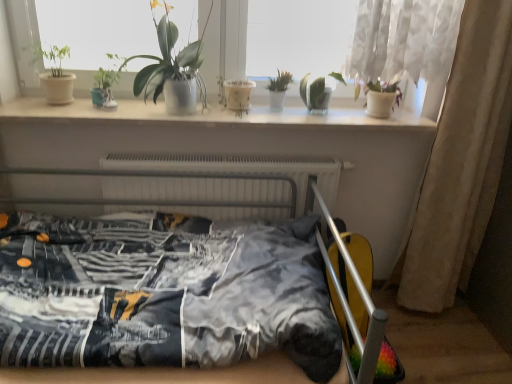
Measure the distance between point (380, 81) and camera.

Point (380, 81) and camera are 1.74 meters apart from each other.

Consider the image. What is the approximate width of green matte plant at center, the second houseplant when ordered from right to left?

It is 3.51 inches.

In order to face green matte plant pot at upper left, the 5th houseplant when ordered from right to left, should I rotate leftwards or rightwards?

Rotate your view left by about 24.827°.

Locate an element on the screen. matte white flowerpot at center is located at coordinates tap(238, 94).

Does point (68, 97) come closer to viewer compared to point (280, 84)?

Yes, it is in front of point (280, 84).

Which of these two, green matte plant pot at upper left, the 5th houseplant when ordered from right to left, or green matte plant at center, the second houseplant when ordered from right to left, stands shorter?

green matte plant at center, the second houseplant when ordered from right to left, is shorter.

From the image's perspective, relative to green matte plant at center, the second houseplant when ordered from right to left, is green matte plant pot at upper left, the 5th houseplant when ordered from right to left, above or below?

green matte plant pot at upper left, the 5th houseplant when ordered from right to left, is situated higher than green matte plant at center, the second houseplant when ordered from right to left, in the image.

Is translucent glass vase at upper center, which appears as the 1th houseplant when viewed from the right, at the right side of matte white flowerpot at center?

Yes.

Could matte white flowerpot at center be considered to be inside translucent glass vase at upper center, positioned as the 5th houseplant in left-to-right order?

No.

From a real-world perspective, who is located higher, translucent glass vase at upper center, positioned as the 5th houseplant in left-to-right order, or matte white flowerpot at center?

From a 3D spatial view, translucent glass vase at upper center, positioned as the 5th houseplant in left-to-right order, is above.

I want to click on flowerpot in front of the translucent glass vase at upper center, positioned as the 5th houseplant in left-to-right order, so click(238, 94).

Who is more distant, green matte pot at upper left, the 4th houseplant viewed from the right, or green matte plant at center, the second houseplant when ordered from right to left?

green matte plant at center, the second houseplant when ordered from right to left.

I want to click on houseplant that is the 1st one when counting upward from the green matte pot at upper left, the 4th houseplant viewed from the right (from the image's perspective), so [278, 89].

Is green matte pot at upper left, which is the second houseplant from left to right, surrounding green matte plant at center, the 4th houseplant from the left?

No, green matte plant at center, the 4th houseplant from the left, is not a part of green matte pot at upper left, which is the second houseplant from left to right.

Is point (100, 91) positioned before point (283, 83)?

Yes, it is in front of point (283, 83).

Is white sheer curtain at right completely or partially outside of green matte pot at upper left, which is the second houseplant from left to right?

Absolutely, white sheer curtain at right is external to green matte pot at upper left, which is the second houseplant from left to right.

From the picture: Considering the relative positions of white sheer curtain at right and green matte pot at upper left, the 4th houseplant viewed from the right, in the image provided, is white sheer curtain at right to the left of green matte pot at upper left, the 4th houseplant viewed from the right, from the viewer's perspective?

Incorrect, white sheer curtain at right is not on the left side of green matte pot at upper left, the 4th houseplant viewed from the right.

From the picture: From the image's perspective, would you say white sheer curtain at right is shown under green matte pot at upper left, which is the second houseplant from left to right?

Correct, white sheer curtain at right appears lower than green matte pot at upper left, which is the second houseplant from left to right, in the image.

There is a white sheer curtain at right. At what (x,y) coordinates should I click in order to perform the action: click on the 2nd houseplant above it (from the image's perspective). Please return your answer as a coordinate pair (x, y). The image size is (512, 384). Looking at the image, I should click on (104, 87).

What's the angular difference between green matte pot at upper left, the 4th houseplant viewed from the right, and pink matte orchid at upper right's facing directions?

The angle between the facing direction of green matte pot at upper left, the 4th houseplant viewed from the right, and the facing direction of pink matte orchid at upper right is 0.000103 degrees.

From the image's perspective, who appears lower, green matte pot at upper left, which is the second houseplant from left to right, or pink matte orchid at upper right?

pink matte orchid at upper right, from the image's perspective.

Looking at this image, which of these two, green matte pot at upper left, which is the second houseplant from left to right, or pink matte orchid at upper right, is smaller?

With smaller size is green matte pot at upper left, which is the second houseplant from left to right.

Does green matte pot at upper left, the 4th houseplant viewed from the right, turn towards pink matte orchid at upper right?

No, green matte pot at upper left, the 4th houseplant viewed from the right, does not turn towards pink matte orchid at upper right.

Which object is more forward, green matte pot at upper left, which is the second houseplant from left to right, or white glossy window sill at upper center?

Positioned in front is white glossy window sill at upper center.

Considering the positions of point (116, 80) and point (93, 115), is point (116, 80) closer or farther from the camera than point (93, 115)?

Point (116, 80) is positioned farther from the camera compared to point (93, 115).

From a real-world perspective, is green matte pot at upper left, the 4th houseplant viewed from the right, located beneath white glossy window sill at upper center?

No, from a real-world perspective, green matte pot at upper left, the 4th houseplant viewed from the right, is not under white glossy window sill at upper center.

Is pink matte orchid at upper right next to green leafy plant at upper center and touching it?

No, pink matte orchid at upper right is not with green leafy plant at upper center.

From a real-world perspective, which object stands above the other?

green leafy plant at upper center is physically above.

Is pink matte orchid at upper right facing towards green leafy plant at upper center?

No, pink matte orchid at upper right is not facing towards green leafy plant at upper center.

Considering the sizes of objects pink matte orchid at upper right and green leafy plant at upper center in the image provided, who is shorter, pink matte orchid at upper right or green leafy plant at upper center?

With less height is pink matte orchid at upper right.

The height and width of the screenshot is (384, 512). What are the coordinates of `the 1st houseplant above when counting from the green matte plant at center, the 4th houseplant from the left (from the image's perspective)` in the screenshot? It's located at (54, 74).

Identify the location of flowerpot that is below the translucent glass vase at upper center, which appears as the 1th houseplant when viewed from the right (from the image's perspective). (238, 94).

Which object lies further to the anchor point green matte plant at center, the 4th houseplant from the left, white metallic radiator at center or white glossy window sill at upper center?

The object further to green matte plant at center, the 4th houseplant from the left, is white metallic radiator at center.

Which object lies nearer to the anchor point green matte plant pot at upper left, arranged as the first houseplant when viewed from the left, white glossy window sill at upper center or matte white flowerpot at center?

white glossy window sill at upper center is closer to green matte plant pot at upper left, arranged as the first houseplant when viewed from the left.

Looking at the image, which one is located closer to white glossy window sill at upper center, green matte plant pot at upper left, arranged as the first houseplant when viewed from the left, or green glossy plant at upper center, the 3th houseplant from the left?

Based on the image, green glossy plant at upper center, the 3th houseplant from the left, appears to be nearer to white glossy window sill at upper center.

Looking at the image, which one is located closer to green glossy plant at upper center, the third houseplant from the right, pink matte orchid at upper right or green leafy plant at upper center?

green leafy plant at upper center is positioned closer to the anchor green glossy plant at upper center, the third houseplant from the right.

Based on their spatial positions, is green matte plant at center, the 4th houseplant from the left, or translucent glass vase at upper center, which appears as the 1th houseplant when viewed from the right, further from green matte pot at upper left, which is the second houseplant from left to right?

translucent glass vase at upper center, which appears as the 1th houseplant when viewed from the right, lies further to green matte pot at upper left, which is the second houseplant from left to right, than the other object.

From the image, which object appears to be farther from white sheer curtain at right, green leafy plant at upper center or pink matte orchid at upper right?

green leafy plant at upper center is further to white sheer curtain at right.

In the scene shown: When comparing their distances from green matte plant pot at upper left, the 5th houseplant when ordered from right to left, does white glossy window sill at upper center or green matte pot at upper left, the 4th houseplant viewed from the right, seem further?

white glossy window sill at upper center is positioned further to the anchor green matte plant pot at upper left, the 5th houseplant when ordered from right to left.

Estimate the real-world distances between objects in this image. Which object is further from matte white flowerpot at center, white glossy window sill at upper center or white metallic radiator at center?

Based on the image, white metallic radiator at center appears to be further to matte white flowerpot at center.

Find the location of a particular element. This screenshot has height=384, width=512. radiator between green matte pot at upper left, which is the second houseplant from left to right, and pink matte orchid at upper right is located at coordinates (240, 169).

The height and width of the screenshot is (384, 512). What are the coordinates of `window between green glossy plant at upper center, the 3th houseplant from the left, and pink matte orchid at upper right` in the screenshot? It's located at (19, 49).

Image resolution: width=512 pixels, height=384 pixels. I want to click on window between green matte plant pot at upper left, the 5th houseplant when ordered from right to left, and green matte plant at center, the second houseplant when ordered from right to left, in the horizontal direction, so click(x=19, y=49).

This screenshot has width=512, height=384. I want to click on flowerpot situated between green leafy plant at upper center and pink matte orchid at upper right from left to right, so click(x=238, y=94).